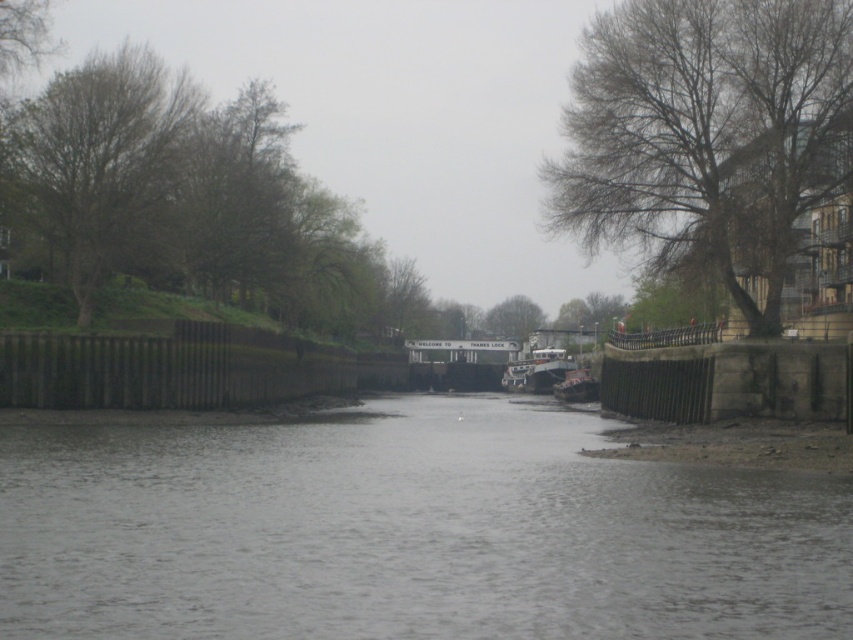
Question: Is gray concrete river at center further to camera compared to metallic gray barge at center?

Choices:
 (A) yes
 (B) no

Answer: (B)

Question: Is gray concrete river at center above metallic gray barge at center?

Choices:
 (A) yes
 (B) no

Answer: (B)

Question: In this image, where is gray concrete river at center located relative to metallic gray barge at center?

Choices:
 (A) below
 (B) above

Answer: (A)

Question: Among these objects, which one is farthest from the camera?

Choices:
 (A) metallic gray barge at center
 (B) gray concrete river at center

Answer: (A)

Question: Which point is closer to the camera taking this photo?

Choices:
 (A) (544, 376)
 (B) (137, 440)

Answer: (B)